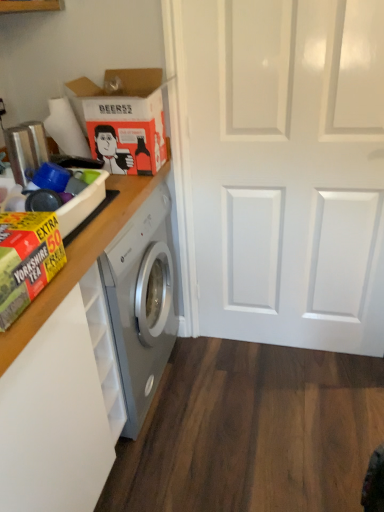
The image size is (384, 512). Identify the location of free space to the left of white glossy door at center. (226, 379).